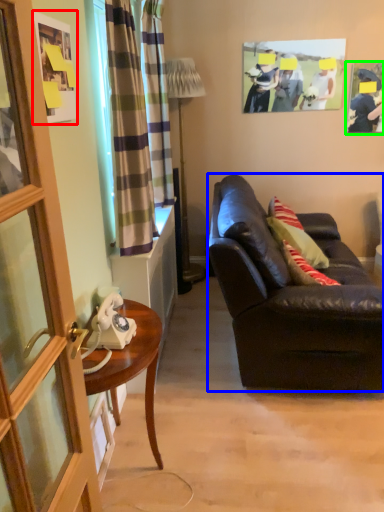
Question: Which is farther away from picture frame (highlighted by a red box)? studio couch (highlighted by a blue box) or picture frame (highlighted by a green box)?

Choices:
 (A) studio couch
 (B) picture frame

Answer: (B)